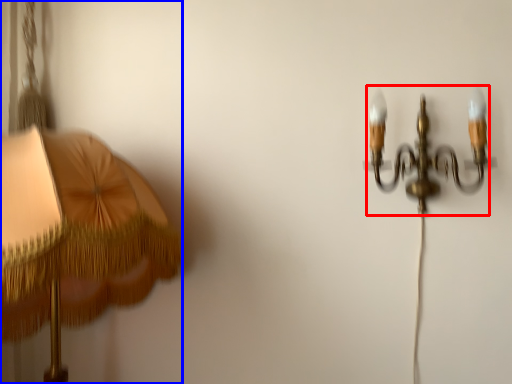
Question: Among these objects, which one is nearest to the camera, lamp (highlighted by a red box) or lamp (highlighted by a blue box)?

Choices:
 (A) lamp
 (B) lamp

Answer: (B)